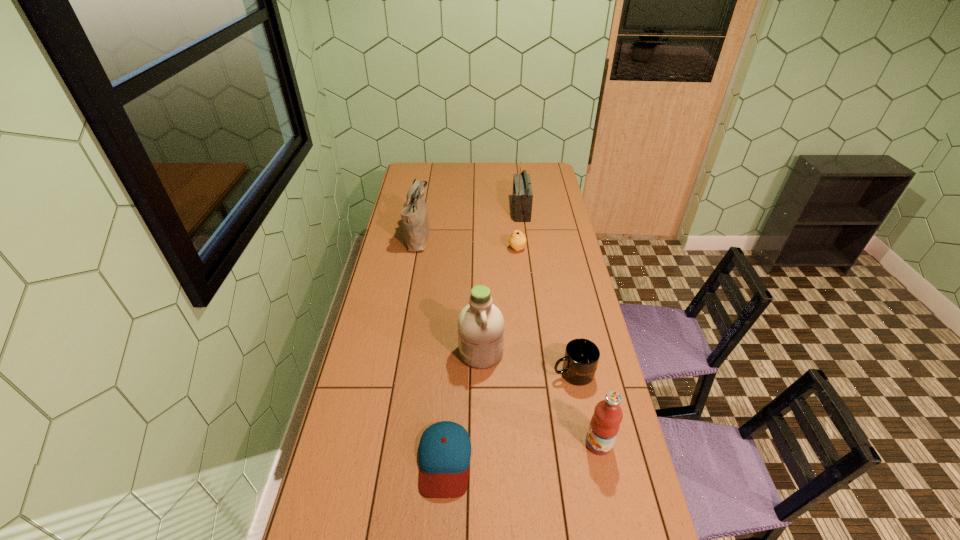
This screenshot has height=540, width=960. I want to click on radio receiver, so click(522, 198).

This screenshot has height=540, width=960. Identify the location of the leftmost object. (414, 216).

At what (x,y) coordinates should I click in order to perform the action: click on cleansing agent. Please return your answer as a coordinate pair (x, y). The image size is (960, 540). Looking at the image, I should click on (480, 324).

I want to click on fruit juice, so click(605, 423).

Where is `mug`? The height and width of the screenshot is (540, 960). mug is located at coordinates (581, 358).

You are a GUI agent. You are given a task and a screenshot of the screen. Output one action in this format:
    pyautogui.click(x=<x>, y=<y>)
    Task: Click on the pear
    
    Given the screenshot: What is the action you would take?
    pyautogui.click(x=517, y=240)

I want to click on baseball cap, so click(x=444, y=453).

This screenshot has height=540, width=960. Find the location of `vacant region located 0.200m on the front panel of the radio receiver`. vacant region located 0.200m on the front panel of the radio receiver is located at coordinates (475, 211).

Image resolution: width=960 pixels, height=540 pixels. I want to click on vacant region located on the front panel of the radio receiver, so click(458, 211).

Where is `free space located 0.260m on the front panel of the radio receiver`? This screenshot has height=540, width=960. free space located 0.260m on the front panel of the radio receiver is located at coordinates (464, 211).